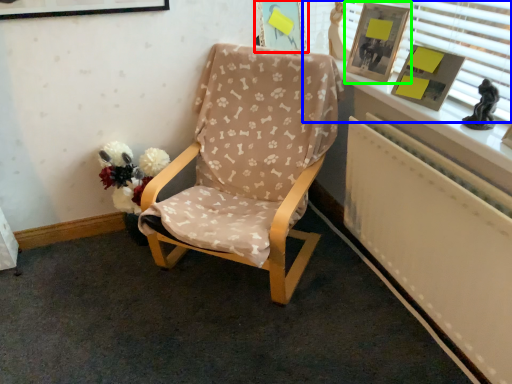
Question: Which is nearer to the picture frame (highlighted by a red box)? window frame (highlighted by a blue box) or picture frame (highlighted by a green box).

Choices:
 (A) window frame
 (B) picture frame

Answer: (B)